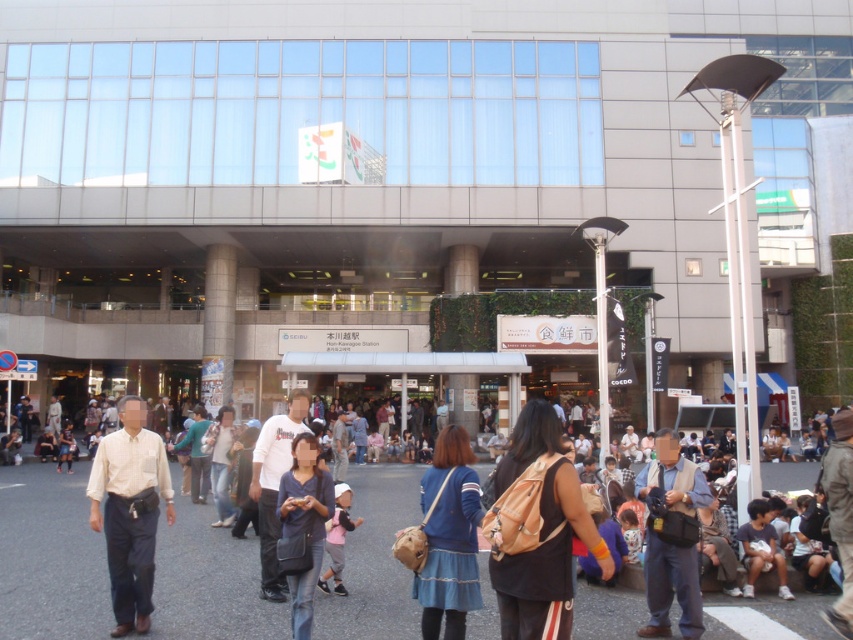
Between light beige shirt at center and blue fabric dress at center, which one has less height?

Standing shorter between the two is blue fabric dress at center.

Where is `light beige shirt at center`? This screenshot has height=640, width=853. light beige shirt at center is located at coordinates (129, 512).

You are a GUI agent. You are given a task and a screenshot of the screen. Output one action in this format:
    pyautogui.click(x=<x>, y=<y>)
    Task: Click on the light beige shirt at center
    
    Given the screenshot: What is the action you would take?
    pyautogui.click(x=129, y=512)

Which is below, light brown leather jacket at center or brown leather backpack at center?

light brown leather jacket at center is below.

Measure the distance between point (312, 632) and camera.

Point (312, 632) and camera are 6.48 meters apart from each other.

The height and width of the screenshot is (640, 853). Identify the location of light brown leather jacket at center. (49, 556).

Who is positioned more to the left, matte gray building at center or light brown leather jacket at center?

Positioned to the left is light brown leather jacket at center.

Who is shorter, matte gray building at center or light brown leather jacket at center?

light brown leather jacket at center

Does point (231, 256) come closer to viewer compared to point (9, 508)?

No, (231, 256) is behind (9, 508).

What are the coordinates of `matte gray building at center` in the screenshot? It's located at (396, 180).